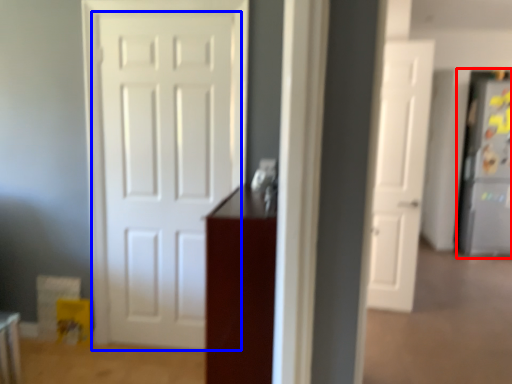
Question: Which point is further to the camera, fridge (highlighted by a red box) or door (highlighted by a blue box)?

Choices:
 (A) fridge
 (B) door

Answer: (A)